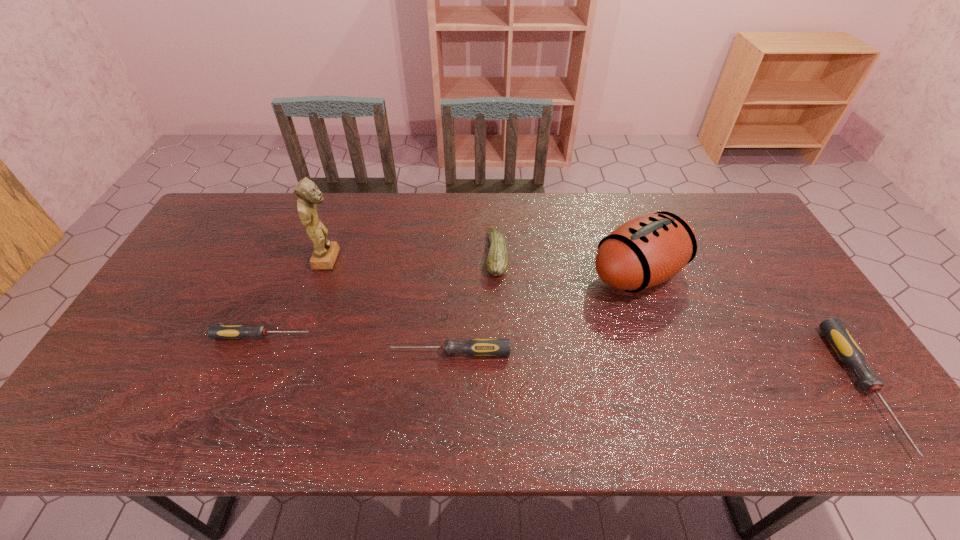
To make them evenly spaced by inserting another screwdriver among them, please locate a free space for this new screwdriver. Please provide its 2D coordinates. Your answer should be formatted as a tuple, i.e. [(x, y)], where the tuple contains the x and y coordinates of a point satisfying the conditions above.

[(650, 369)]